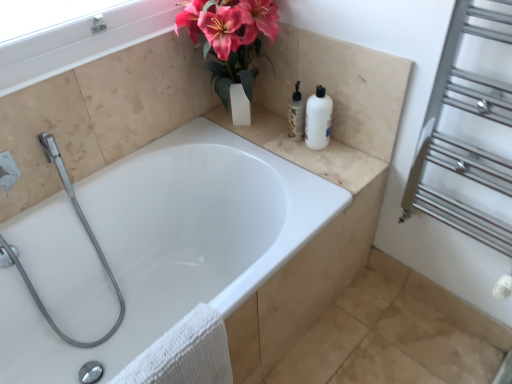
Question: Does silver metallic towel rack at right have a larger size compared to beige marble counter top at upper right?

Choices:
 (A) no
 (B) yes

Answer: (B)

Question: Is silver metallic towel rack at right smaller than beige marble counter top at upper right?

Choices:
 (A) no
 (B) yes

Answer: (A)

Question: From a real-world perspective, is silver metallic towel rack at right under beige marble counter top at upper right?

Choices:
 (A) no
 (B) yes

Answer: (A)

Question: From a real-world perspective, is silver metallic towel rack at right physically above beige marble counter top at upper right?

Choices:
 (A) yes
 (B) no

Answer: (A)

Question: Considering the relative sizes of silver metallic towel rack at right and beige marble counter top at upper right in the image provided, is silver metallic towel rack at right thinner than beige marble counter top at upper right?

Choices:
 (A) yes
 (B) no

Answer: (A)

Question: Is point (134, 165) positioned closer to the camera than point (456, 109)?

Choices:
 (A) farther
 (B) closer

Answer: (A)

Question: From a real-world perspective, is white glossy bathtub at center above or below silver metallic towel rack at right?

Choices:
 (A) above
 (B) below

Answer: (B)

Question: Is white glossy bathtub at center in front of or behind silver metallic towel rack at right in the image?

Choices:
 (A) behind
 (B) front

Answer: (A)

Question: Looking at the image, does white glossy bathtub at center seem bigger or smaller compared to silver metallic towel rack at right?

Choices:
 (A) small
 (B) big

Answer: (B)

Question: In the image, is white plastic bottle at upper right positioned in front of or behind beige marble counter top at upper right?

Choices:
 (A) behind
 (B) front

Answer: (A)

Question: Is white plastic bottle at upper right wider or thinner than beige marble counter top at upper right?

Choices:
 (A) wide
 (B) thin

Answer: (B)

Question: In terms of height, does white plastic bottle at upper right look taller or shorter compared to beige marble counter top at upper right?

Choices:
 (A) short
 (B) tall

Answer: (B)

Question: Considering the positions of point (326, 124) and point (224, 112), is point (326, 124) closer or farther from the camera than point (224, 112)?

Choices:
 (A) closer
 (B) farther

Answer: (A)

Question: Considering the positions of beige marble counter top at upper right and white textured towel at lower left in the image, is beige marble counter top at upper right wider or thinner than white textured towel at lower left?

Choices:
 (A) wide
 (B) thin

Answer: (A)

Question: Considering the positions of point (249, 125) and point (222, 377), is point (249, 125) closer or farther from the camera than point (222, 377)?

Choices:
 (A) farther
 (B) closer

Answer: (A)